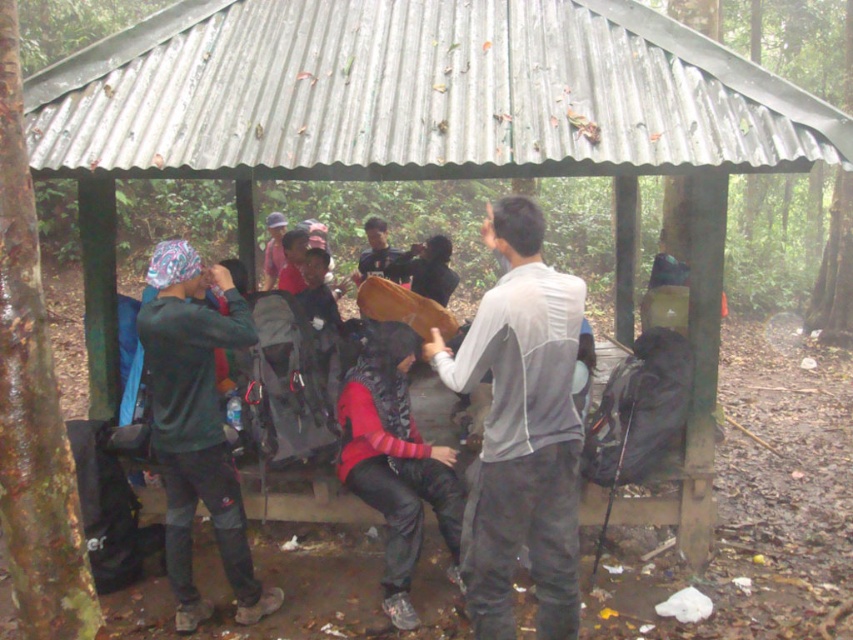
Is gray matte shirt at center thinner than dark gray fabric shirt at center?

No, gray matte shirt at center is not thinner than dark gray fabric shirt at center.

Which is more to the right, gray matte shirt at center or dark gray fabric shirt at center?

Positioned to the right is gray matte shirt at center.

Is point (503, 589) in front of point (396, 268)?

Yes.

At what (x,y) coordinates should I click in order to perform the action: click on gray matte shirt at center. Please return your answer as a coordinate pair (x, y). This screenshot has width=853, height=640. Looking at the image, I should click on (521, 429).

In the scene shown: Does dark green fabric jacket at left have a lesser width compared to dark gray fabric shirt at center?

Incorrect, dark green fabric jacket at left's width is not less than dark gray fabric shirt at center's.

Which of these two, dark green fabric jacket at left or dark gray fabric shirt at center, stands shorter?

With less height is dark gray fabric shirt at center.

Which is behind, point (210, 280) or point (364, 275)?

The point (364, 275) is behind.

Find the location of a particular element. dark green fabric jacket at left is located at coordinates (196, 426).

Between red sweater at center and dark gray fabric shirt at center, which one appears on the left side from the viewer's perspective?

dark gray fabric shirt at center

Is red sweater at center in front of dark gray fabric shirt at center?

Yes, red sweater at center is closer to the viewer.

Does point (453, 557) lie behind point (369, 230)?

No, (453, 557) is in front of (369, 230).

The height and width of the screenshot is (640, 853). Identify the location of red sweater at center. (395, 461).